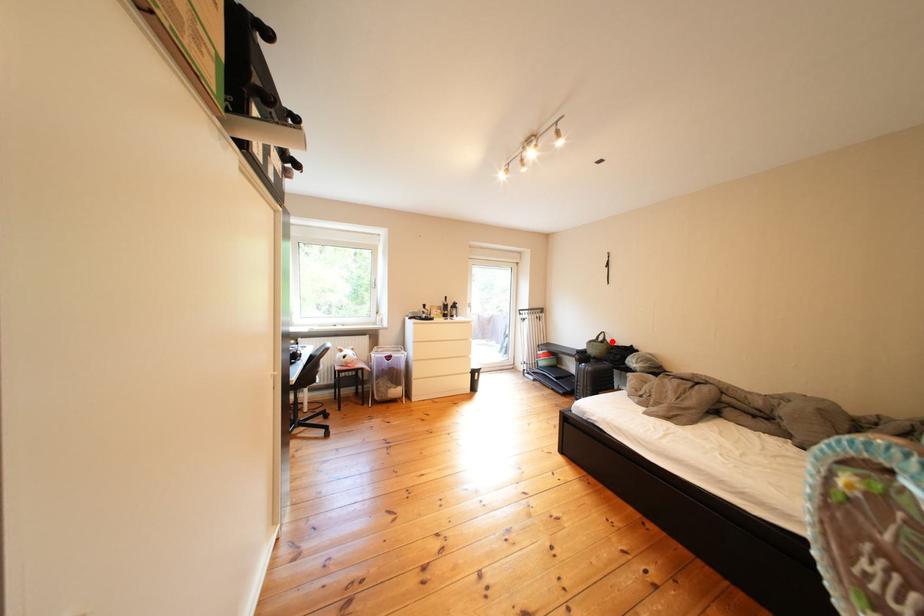
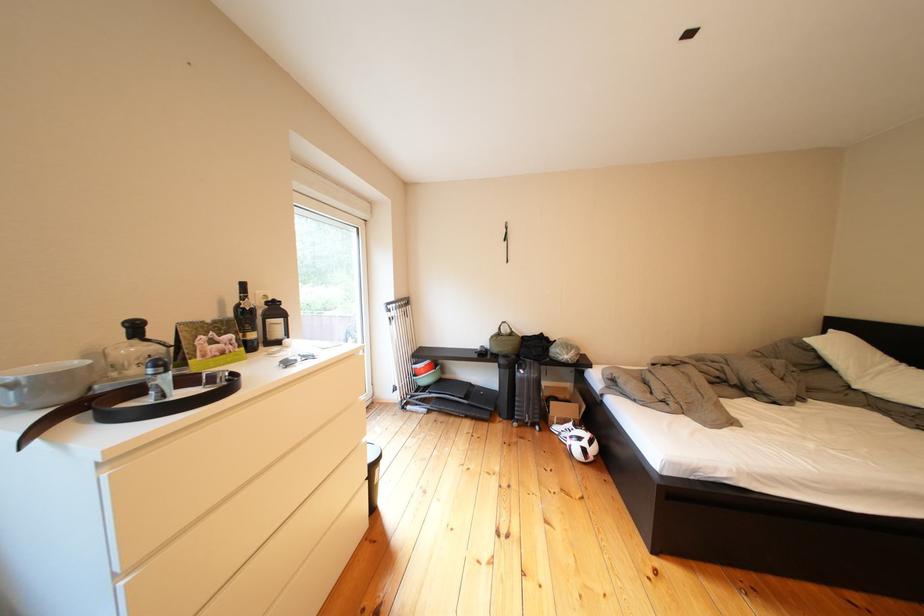
In the second image, find the point that corresponds to the highlighted location in the first image.

(514, 334)